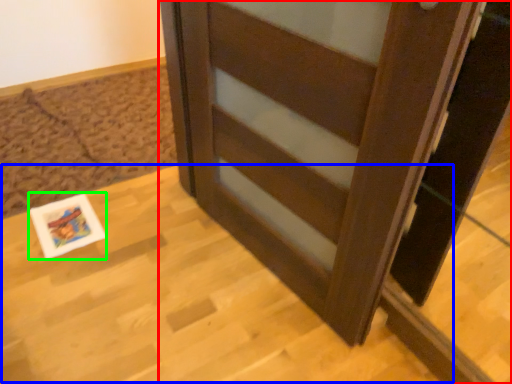
Question: Considering the real-world distances, which object is closest to furniture (highlighted by a red box)? table (highlighted by a blue box) or postcard (highlighted by a green box).

Choices:
 (A) table
 (B) postcard

Answer: (A)